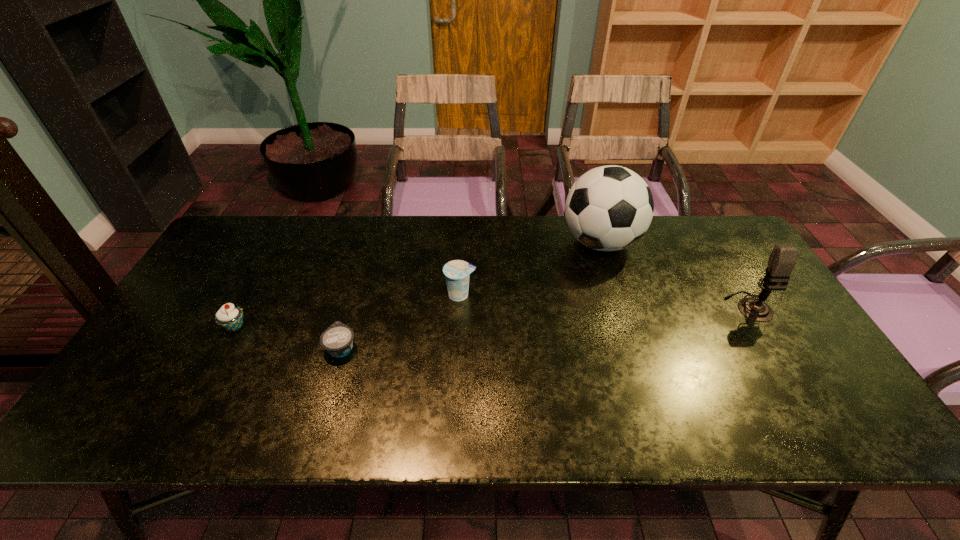
At what (x,y) coordinates should I click in order to perform the action: click on the farthest object. Please return your answer as a coordinate pair (x, y). Looking at the image, I should click on (608, 208).

I want to click on soccer ball, so 608,208.

Where is `the rightmost object`? the rightmost object is located at coordinates (782, 260).

Where is `the fourth shortest object`? The height and width of the screenshot is (540, 960). the fourth shortest object is located at coordinates (782, 260).

Locate an element on the screen. This screenshot has height=540, width=960. the right yogurt is located at coordinates (457, 272).

Locate an element on the screen. The height and width of the screenshot is (540, 960). the third object from right to left is located at coordinates (457, 272).

Identify the location of cupcake. (230, 317).

Identify the location of the fourth object from right to left. The height and width of the screenshot is (540, 960). (337, 340).

Image resolution: width=960 pixels, height=540 pixels. I want to click on the nearer yogurt, so (337, 340).

This screenshot has width=960, height=540. In order to click on vacant space positioned 0.130m on the left of the farthest object in this screenshot , I will do click(520, 242).